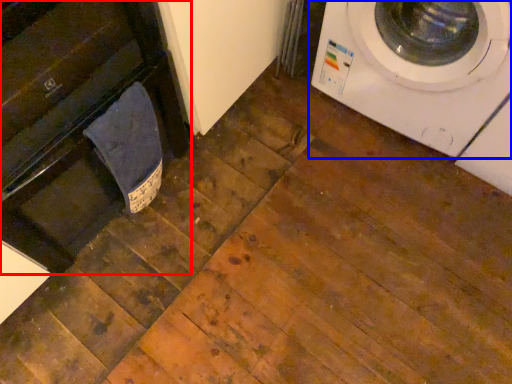
Question: Which object appears closest to the camera in this image, dish washer (highlighted by a red box) or washing machine (highlighted by a blue box)?

Choices:
 (A) dish washer
 (B) washing machine

Answer: (A)